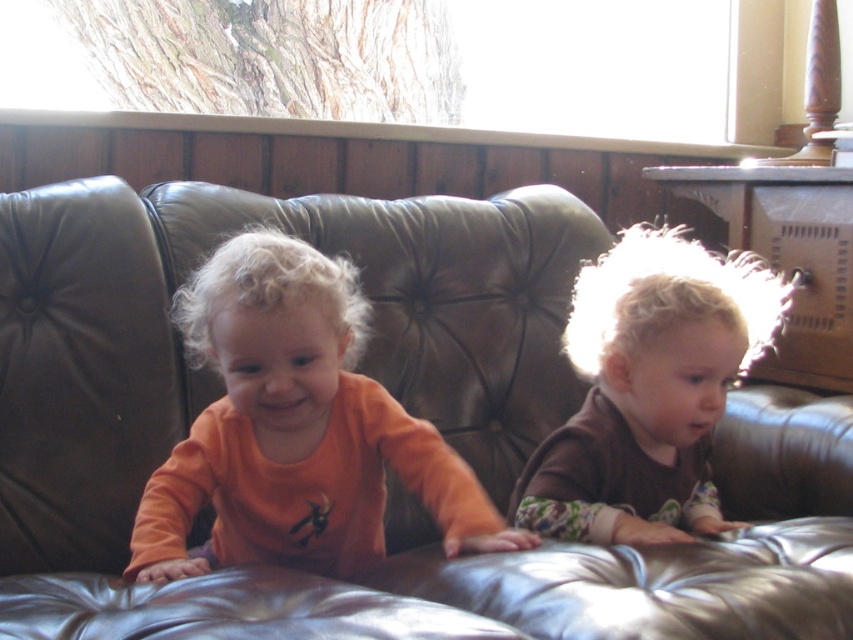
Question: Which of the following is the farthest from the observer?

Choices:
 (A) brown fuzzy sweater at right
 (B) leather couch at center

Answer: (A)

Question: Which point is farther to the camera?

Choices:
 (A) (381, 589)
 (B) (699, 408)
 (C) (202, 472)

Answer: (B)

Question: Can you confirm if leather couch at center is wider than brown fuzzy sweater at right?

Choices:
 (A) no
 (B) yes

Answer: (B)

Question: Does leather couch at center appear on the left side of orange soft fabric toddler at center?

Choices:
 (A) yes
 (B) no

Answer: (B)

Question: Which point is farther from the camera taking this photo?

Choices:
 (A) (769, 630)
 (B) (332, 500)
 (C) (670, 381)

Answer: (C)

Question: Is leather couch at center closer to camera compared to brown fuzzy sweater at right?

Choices:
 (A) no
 (B) yes

Answer: (B)